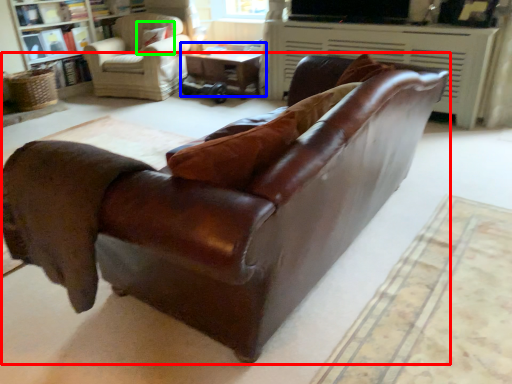
Question: Which object is the farthest from studio couch (highlighted by a red box)? Choose among these: table (highlighted by a blue box) or pillow (highlighted by a green box).

Choices:
 (A) table
 (B) pillow

Answer: (B)